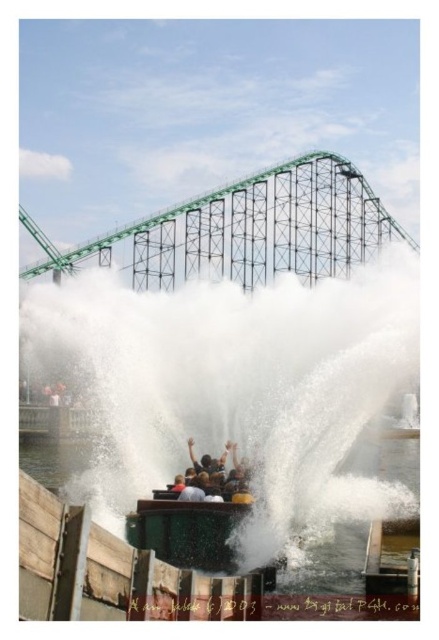
Is white frothy water at center behind white frothy water at lower center?

Yes, white frothy water at center is behind white frothy water at lower center.

Is white frothy water at center above white frothy water at lower center?

Indeed, white frothy water at center is positioned over white frothy water at lower center.

The height and width of the screenshot is (640, 439). What do you see at coordinates (241, 388) in the screenshot?
I see `white frothy water at center` at bounding box center [241, 388].

The image size is (439, 640). In order to click on white frothy water at center in this screenshot , I will do `click(241, 388)`.

Between white frothy water at lower center and dark brown hair at center, which one is positioned higher?

Positioned higher is dark brown hair at center.

Does point (381, 468) come closer to viewer compared to point (218, 470)?

No, it is not.

Describe the element at coordinates (337, 570) in the screenshot. I see `white frothy water at lower center` at that location.

Locate an element on the screen. This screenshot has height=640, width=439. white frothy water at lower center is located at coordinates (337, 570).

Between white frothy water at center and dark brown hair at center, which one has less height?

Standing shorter between the two is dark brown hair at center.

Is white frothy water at center bigger than dark brown hair at center?

Yes, white frothy water at center is bigger than dark brown hair at center.

The width and height of the screenshot is (439, 640). Describe the element at coordinates (241, 388) in the screenshot. I see `white frothy water at center` at that location.

Find the location of a particular element. Image resolution: width=439 pixels, height=640 pixels. white frothy water at center is located at coordinates (241, 388).